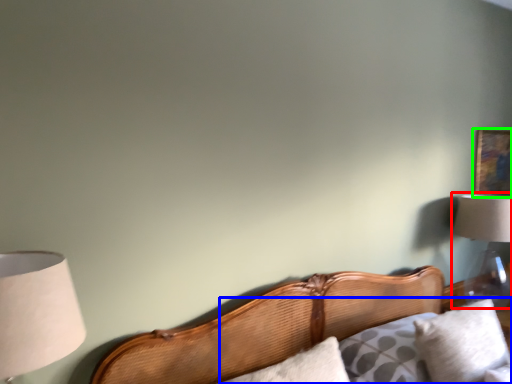
Question: Which object is positioned closest to lamp (highlighted by a red box)? Select from couch (highlighted by a blue box) and picture frame (highlighted by a green box).

Choices:
 (A) couch
 (B) picture frame

Answer: (B)